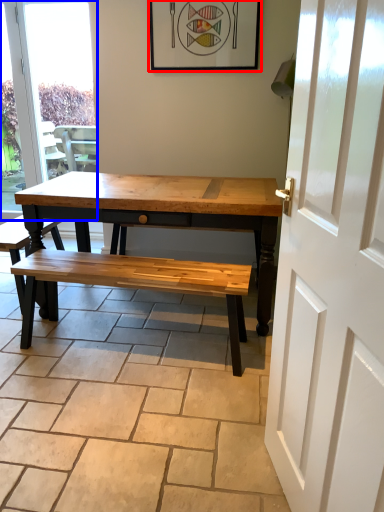
Question: Which object is closer to the camera taking this photo, picture frame (highlighted by a red box) or window (highlighted by a blue box)?

Choices:
 (A) picture frame
 (B) window

Answer: (A)